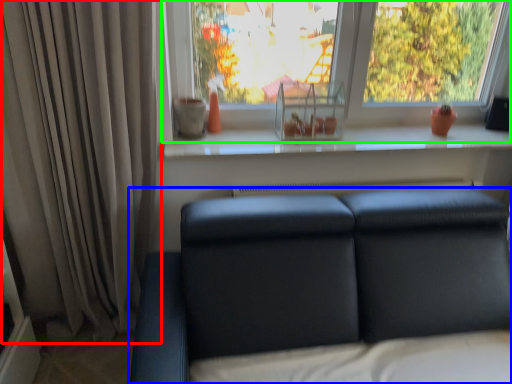
Question: Which is nearer to the curtain (highlighted by a red box)? studio couch (highlighted by a blue box) or window (highlighted by a green box).

Choices:
 (A) studio couch
 (B) window

Answer: (A)